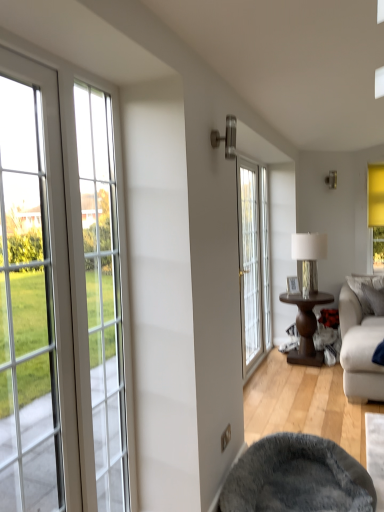
Find the location of a particular element. The height and width of the screenshot is (512, 384). free point in front of wooden picture frame at center is located at coordinates (299, 296).